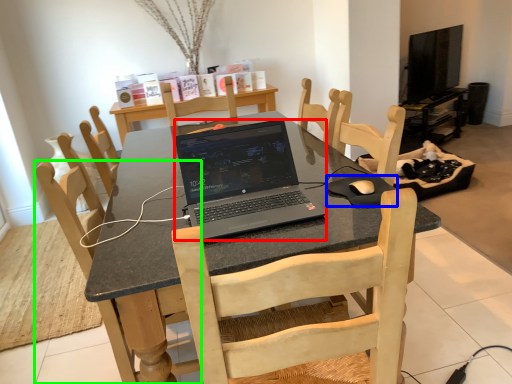
Question: Which object is positioned farthest from laptop (highlighted by a red box)? Select from mousepad (highlighted by a blue box) and chair (highlighted by a green box).

Choices:
 (A) mousepad
 (B) chair

Answer: (B)